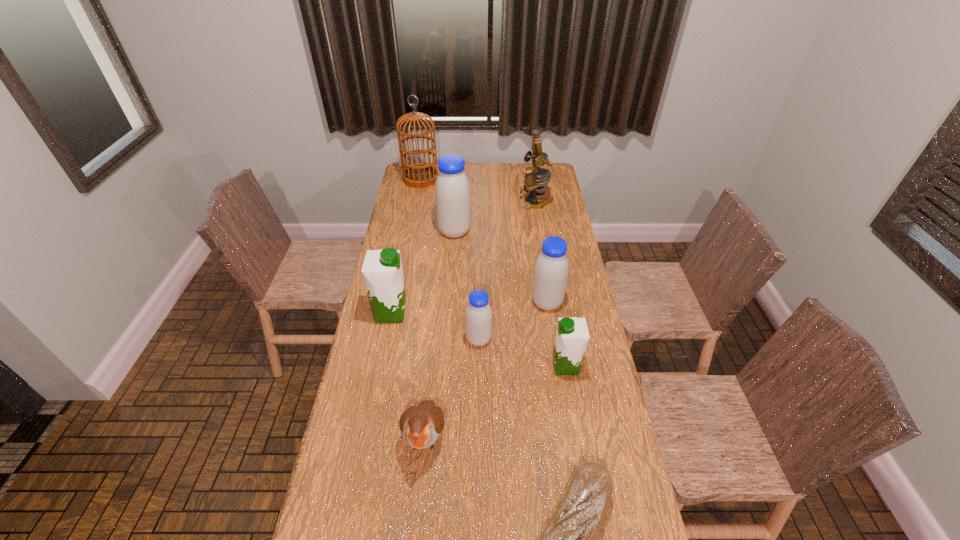
I want to click on vacant space located 0.070m on the front-facing side of the nearer green soya milk, so click(531, 366).

Where is `vacant space located on the front-facing side of the nearer green soya milk`? This screenshot has width=960, height=540. vacant space located on the front-facing side of the nearer green soya milk is located at coordinates (473, 366).

This screenshot has height=540, width=960. I want to click on vacant region located on the front of the fourth nearest object, so click(x=478, y=391).

Identify the location of vacant space located 0.050m at the face of the brown bird. (420, 492).

Image resolution: width=960 pixels, height=540 pixels. I want to click on object located at the far edge, so click(x=418, y=175).

What are the coordinates of `birdcage present at the left edge` in the screenshot? It's located at (418, 175).

I want to click on soya milk that is at the left edge, so click(x=382, y=272).

This screenshot has width=960, height=540. Identify the location of microscope present at the right edge. (534, 185).

The width and height of the screenshot is (960, 540). In order to click on object positioned at the far left corner in this screenshot , I will do `click(418, 175)`.

Image resolution: width=960 pixels, height=540 pixels. In the image, there is a desktop. What are the coordinates of `vacant space at the far edge` in the screenshot? It's located at (506, 181).